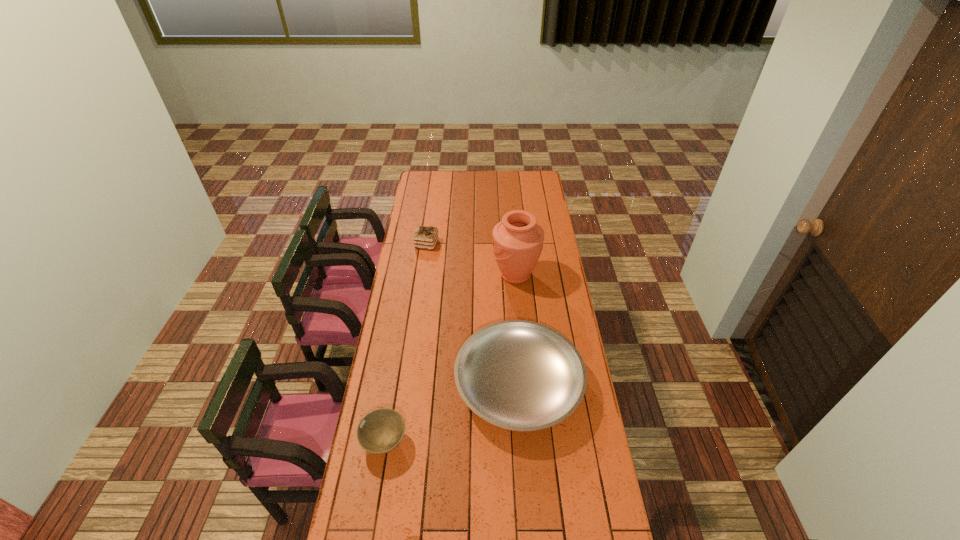
The image size is (960, 540). In order to click on vase in this screenshot , I will do `click(518, 240)`.

Identify the location of the tallest object. (518, 240).

The image size is (960, 540). Identify the location of bedpan. (520, 375).

Find the location of a particular element. the farthest object is located at coordinates (425, 237).

Identify the location of bowl. (380, 431).

At what (x,y) coordinates should I click in order to perform the action: click on vacant space located on the back of the third nearest object. Please return your answer as a coordinate pair (x, y). Looking at the image, I should click on (513, 239).

The image size is (960, 540). I want to click on vacant position located on the left of the bedpan, so click(x=395, y=384).

Where is `vacant space located on the right of the farthest object`? The width and height of the screenshot is (960, 540). vacant space located on the right of the farthest object is located at coordinates (473, 244).

I want to click on free space located 0.140m on the front of the bowl, so click(x=373, y=509).

Where is `chocolate cake that is at the left edge`? chocolate cake that is at the left edge is located at coordinates (425, 237).